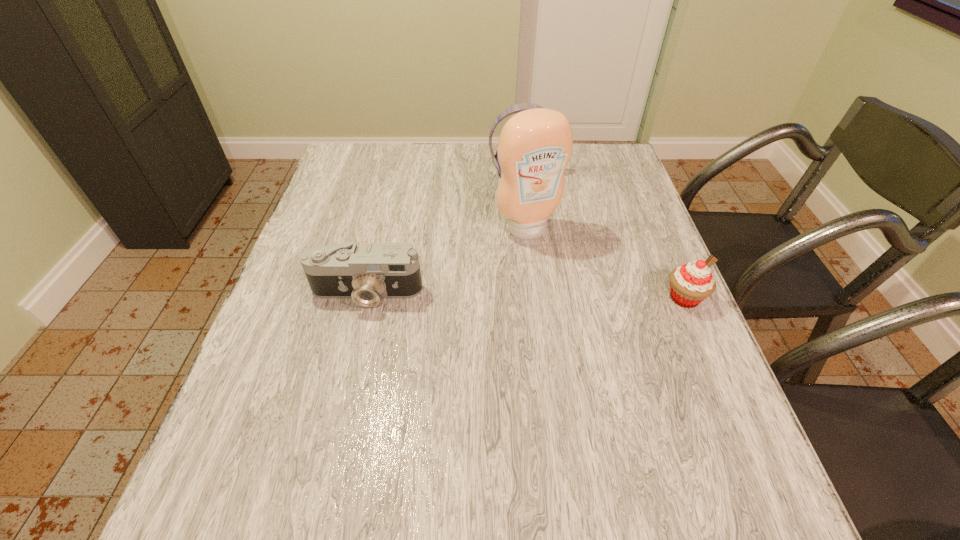
Find the location of a particular element. blank region between the camera and the rightmost object is located at coordinates (525, 295).

The width and height of the screenshot is (960, 540). Identify the location of free space between the cupcake and the farthest object. (603, 236).

Find the location of a particular element. free space between the condiment and the rightmost object is located at coordinates (606, 264).

Locate which object is the third closest to the second farthest object. Please provide its 2D coordinates. Your answer should be formatted as a tuple, i.e. [(x, y)], where the tuple contains the x and y coordinates of a point satisfying the conditions above.

[(690, 284)]

Select which object is the second closest to the tallest object. Please provide its 2D coordinates. Your answer should be formatted as a tuple, i.e. [(x, y)], where the tuple contains the x and y coordinates of a point satisfying the conditions above.

[(366, 273)]

You are a GUI agent. You are given a task and a screenshot of the screen. Output one action in this format:
    pyautogui.click(x=<x>, y=<y>)
    Task: Click on the vacant space that satisfies the following two spatial constraints: 1. on the front side of the cupcake; 2. on the left side of the third shortest object
    This screenshot has width=960, height=540.
    Given the screenshot: What is the action you would take?
    pyautogui.click(x=535, y=298)